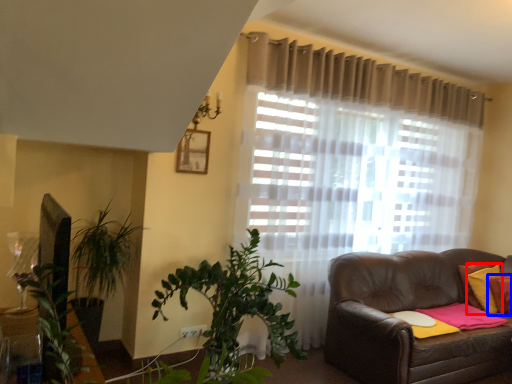
Question: Among these objects, which one is nearest to the camera, pillow (highlighted by a red box) or pillow (highlighted by a blue box)?

Choices:
 (A) pillow
 (B) pillow

Answer: (B)